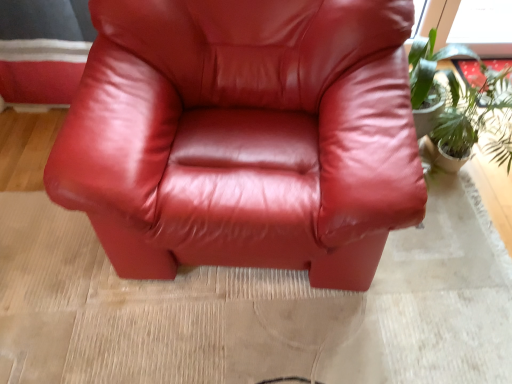
Question: Considering the positions of point (243, 180) and point (471, 134), is point (243, 180) closer or farther from the camera than point (471, 134)?

Choices:
 (A) closer
 (B) farther

Answer: (A)

Question: Considering the positions of glossy leather chair at center and green leafy plant at right in the image, is glossy leather chair at center wider or thinner than green leafy plant at right?

Choices:
 (A) thin
 (B) wide

Answer: (B)

Question: Visually, is glossy leather chair at center positioned to the left or to the right of green leafy plant at right?

Choices:
 (A) right
 (B) left

Answer: (B)

Question: Is green leafy plant at right taller or shorter than glossy leather chair at center?

Choices:
 (A) short
 (B) tall

Answer: (A)

Question: In terms of size, does green leafy plant at right appear bigger or smaller than glossy leather chair at center?

Choices:
 (A) big
 (B) small

Answer: (B)

Question: Do you think green leafy plant at right is within glossy leather chair at center, or outside of it?

Choices:
 (A) outside
 (B) inside

Answer: (A)

Question: From the image's perspective, relative to glossy leather chair at center, is green leafy plant at right above or below?

Choices:
 (A) above
 (B) below

Answer: (A)